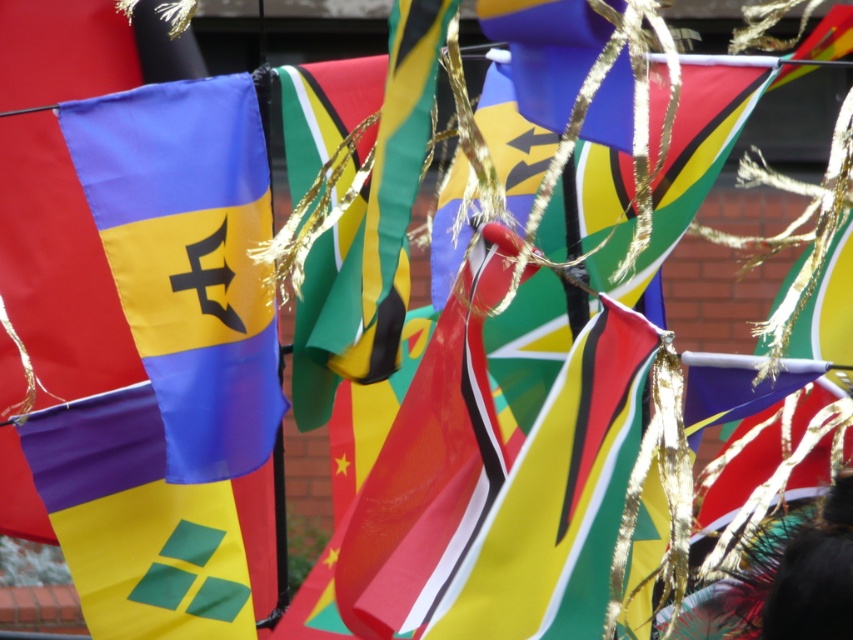
Can you confirm if matte blue flag at left is bigger than matte fabric flag at lower left?

Actually, matte blue flag at left might be smaller than matte fabric flag at lower left.

Is matte blue flag at left shorter than matte fabric flag at lower left?

In fact, matte blue flag at left may be taller than matte fabric flag at lower left.

Does point (213, 372) lie behind point (154, 602)?

That is False.

Find the location of a particular element. The width and height of the screenshot is (853, 640). matte blue flag at left is located at coordinates (189, 259).